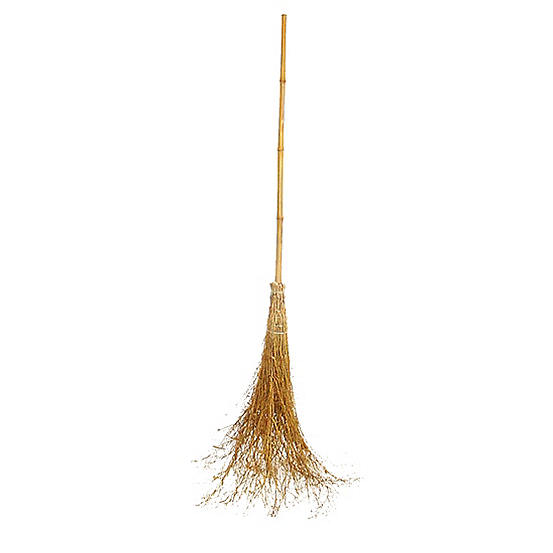
The width and height of the screenshot is (553, 553). I want to click on broom, so click(x=278, y=365).